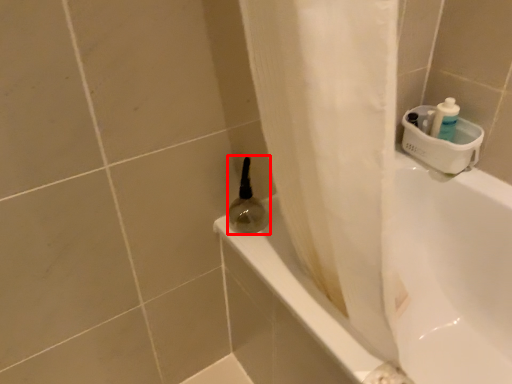
Question: In this image, where is mouthwash (annotated by the red box) located relative to bathtub?

Choices:
 (A) left
 (B) right

Answer: (A)